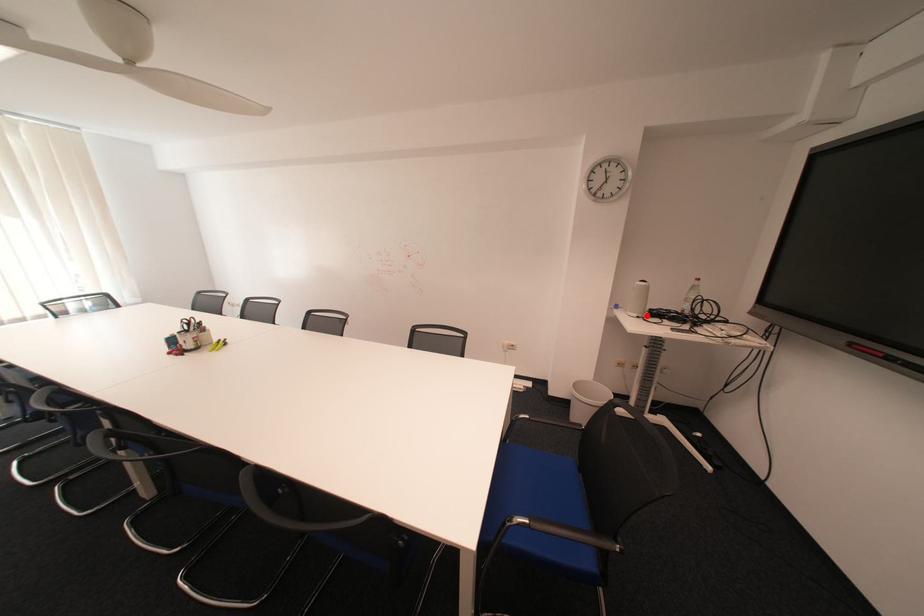
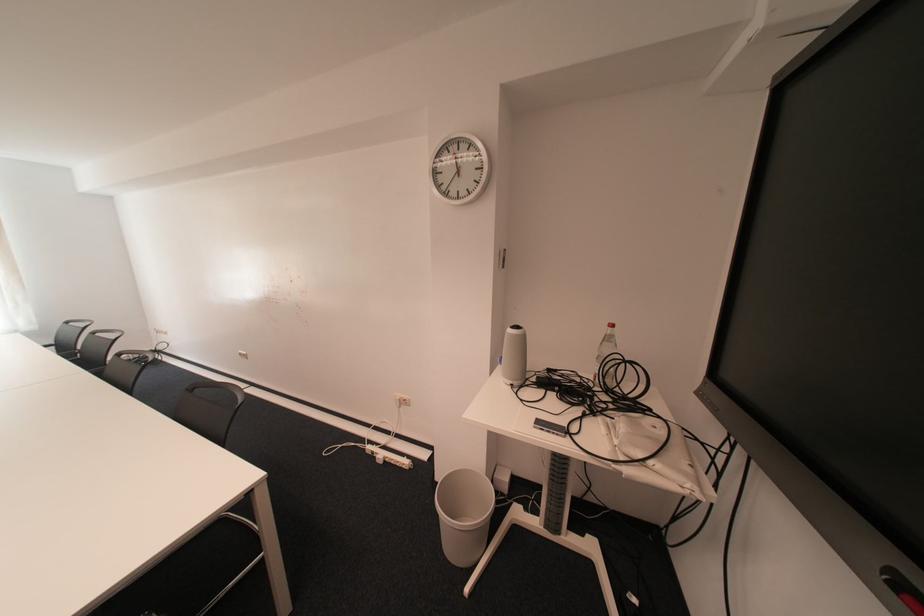
In the second image, find the point that corresponds to the highlighted location in the first image.

(520, 383)